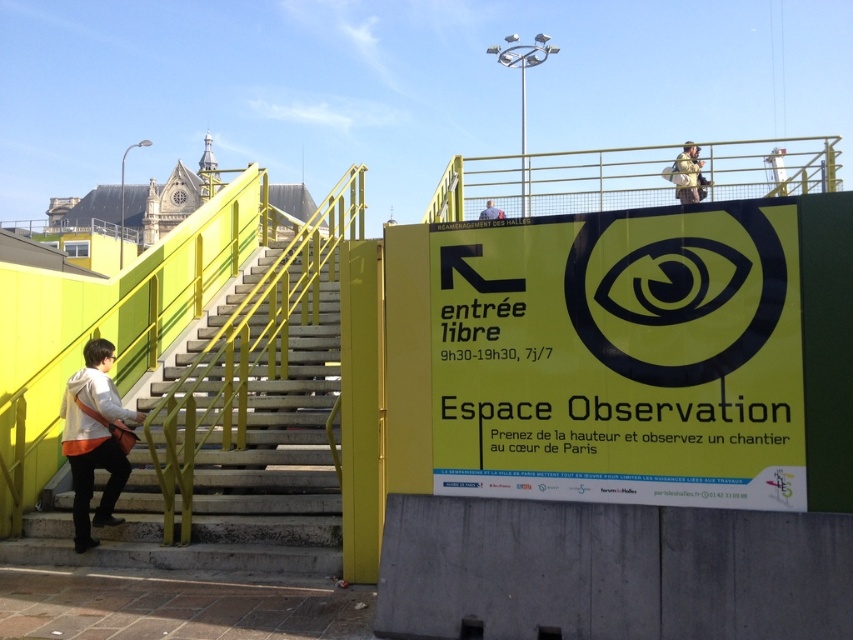
Question: Which point is farther to the camera?

Choices:
 (A) (701, 182)
 (B) (726, 173)
 (C) (479, 220)
 (D) (126, 465)

Answer: (A)

Question: Which object is closer to the camera taking this photo?

Choices:
 (A) matte blue shirt at upper center
 (B) camouflage fabric backpack at upper center

Answer: (B)

Question: Which point appears farthest from the camera in this image?

Choices:
 (A) [666, 177]
 (B) [679, 358]
 (C) [1, 545]

Answer: (A)

Question: Is yellow matte sign at center bigger than white hoodie at lower left?

Choices:
 (A) no
 (B) yes

Answer: (B)

Question: Is white hoodie at lower left behind matte blue shirt at upper center?

Choices:
 (A) no
 (B) yes

Answer: (A)

Question: Does yellow metal railing at upper center have a greater width compared to matte blue shirt at upper center?

Choices:
 (A) yes
 (B) no

Answer: (A)